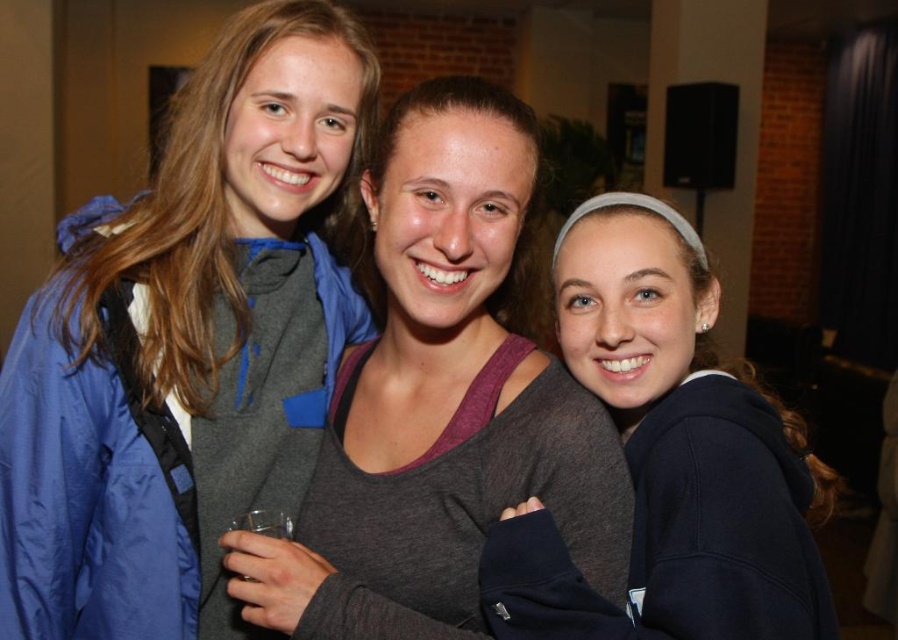
You are a photographer adjusting your camera settings to focus on the matte gray hoodie at center and the gray matte tank top at center. Which piece of clothing should you focus on first to ensure it appears sharp in the photo?

The matte gray hoodie at center should be focused on first because it is closer to the viewer than the gray matte tank top at center, ensuring it will appear sharp in the photo.